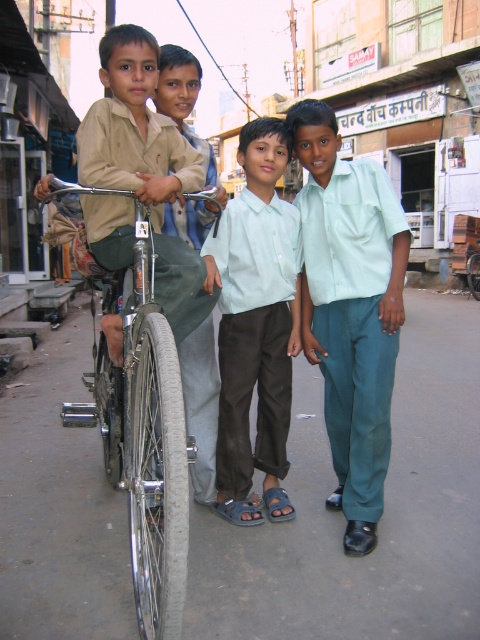
Question: Does light green cotton shirt at center have a larger size compared to shiny metallic bicycle at left?

Choices:
 (A) no
 (B) yes

Answer: (A)

Question: Which object is the closest to the light green fabric shirt at center?

Choices:
 (A) matte khaki shirt at left
 (B) shiny metallic bicycle at left

Answer: (A)

Question: Does light green fabric shirt at center appear on the right side of shiny metallic bicycle at left?

Choices:
 (A) yes
 (B) no

Answer: (A)

Question: Can you confirm if light green fabric shirt at center is positioned above shiny metallic bicycle at left?

Choices:
 (A) no
 (B) yes

Answer: (B)

Question: Based on their relative distances, which object is nearer to the light green cotton shirt at center?

Choices:
 (A) matte khaki shirt at left
 (B) shiny metallic bicycle at left

Answer: (A)

Question: Which object is the farthest from the shiny metallic bicycle at left?

Choices:
 (A) matte khaki shirt at left
 (B) light green cotton shirt at center

Answer: (B)